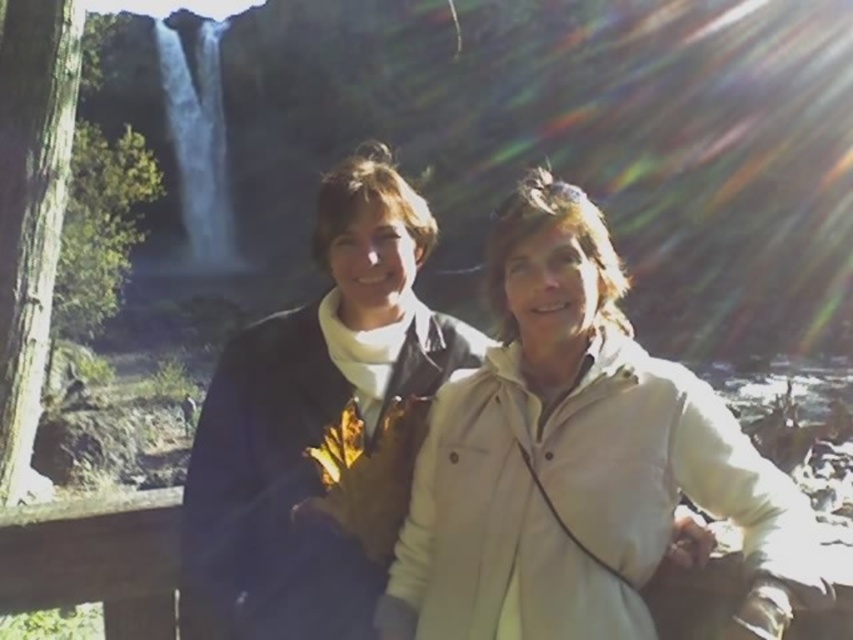
Is wooden rail at center below white smooth water at upper left?

Correct, wooden rail at center is located below white smooth water at upper left.

Who is more forward, [850,596] or [183,211]?

Point [850,596]

This screenshot has height=640, width=853. I want to click on wooden rail at center, so click(96, 557).

Is dark blue jacket at center shorter than white smooth water at upper left?

Yes.

Consider the image. Which is more to the left, dark blue jacket at center or white smooth water at upper left?

white smooth water at upper left

Find the location of a particular element. dark blue jacket at center is located at coordinates (318, 426).

Image resolution: width=853 pixels, height=640 pixels. Find the location of `dark blue jacket at center`. dark blue jacket at center is located at coordinates (318, 426).

Locate an element on the screen. The image size is (853, 640). dark blue jacket at center is located at coordinates (318, 426).

Between point (386, 227) and point (688, 624), which one is positioned in front?

Point (688, 624) is in front.

Who is more distant from viewer, (381,401) or (128,632)?

Positioned behind is point (381,401).

Identify the location of dark blue jacket at center. (318, 426).